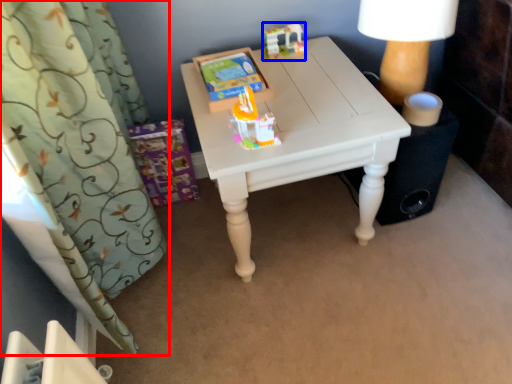
Question: Which object is further to the camera taking this photo, curtain (highlighted by a red box) or toy (highlighted by a blue box)?

Choices:
 (A) curtain
 (B) toy

Answer: (B)